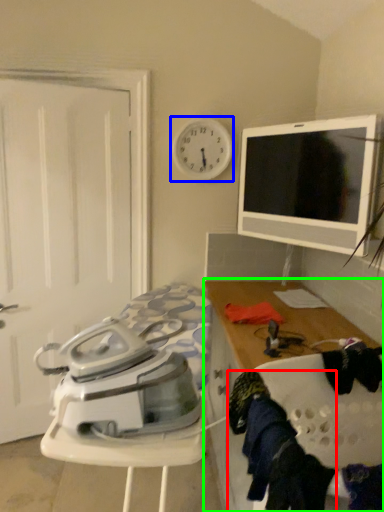
Question: Which object is positioned farthest from clothing (highlighted by a red box)? Select from clock (highlighted by a blue box) and cabinetry (highlighted by a green box).

Choices:
 (A) clock
 (B) cabinetry

Answer: (A)